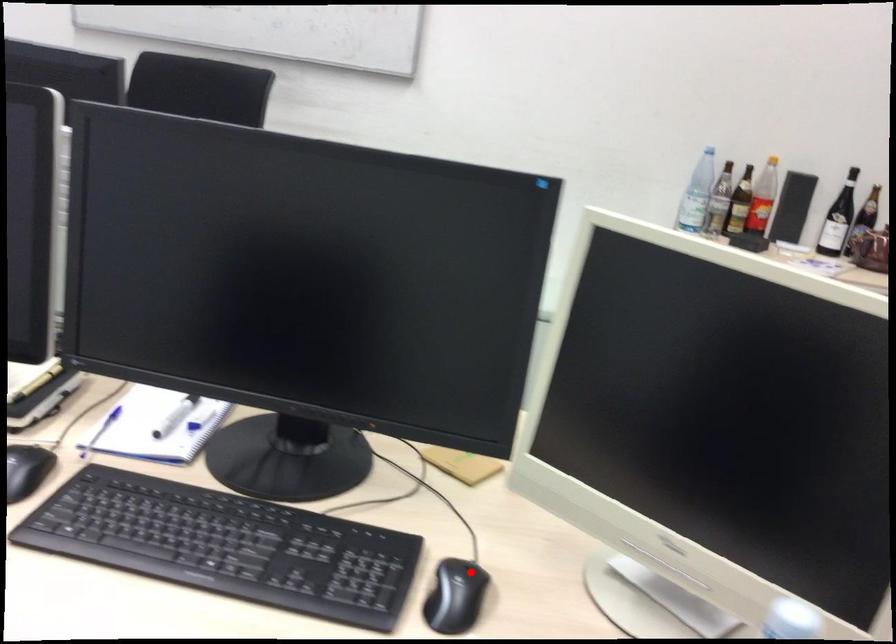
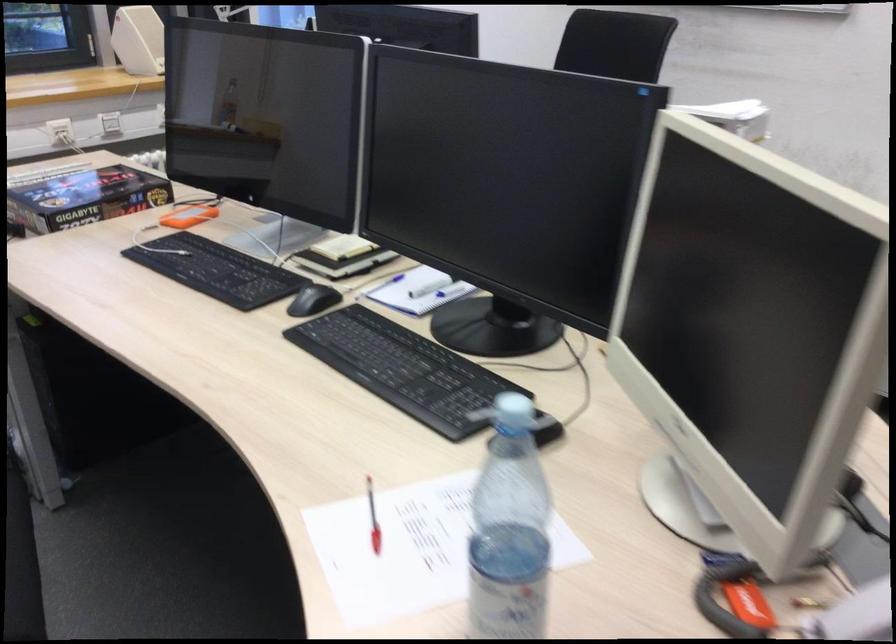
Question: A red point is marked in image1. In image2, is the corresponding 3D point closer to the camera or farther? Reply with the corresponding letter.

Choices:
 (A) The corresponding 3D point is closer.
 (B) The corresponding 3D point is farther.

Answer: (B)